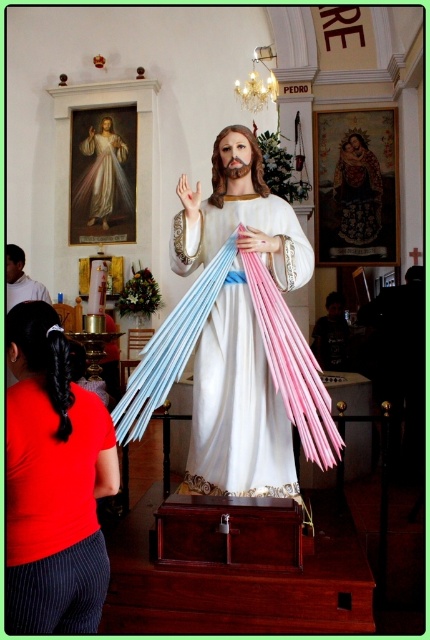
Which is below, matte red shirt at center or embroidered fabric portrait at upper center?

matte red shirt at center is lower down.

Is matte red shirt at center wider than embroidered fabric portrait at upper center?

Yes.

Is point (279, 452) less distant than point (374, 220)?

Yes, point (279, 452) is closer to viewer.

Find the location of `matte red shirt at center`. matte red shirt at center is located at coordinates (236, 406).

Is red pinstripe pants at lower left taller than white glossy robe at upper center?

No.

Based on the photo, which is more to the left, red pinstripe pants at lower left or white glossy robe at upper center?

Positioned to the left is white glossy robe at upper center.

What are the coordinates of `red pinstripe pants at lower left` in the screenshot? It's located at (52, 483).

Who is higher up, matte red shirt at center or white glossy robe at upper center?

white glossy robe at upper center is higher up.

Who is more forward, (249, 170) or (126, 193)?

Positioned in front is point (249, 170).

The height and width of the screenshot is (640, 430). Find the location of `matte red shirt at center`. matte red shirt at center is located at coordinates click(x=236, y=406).